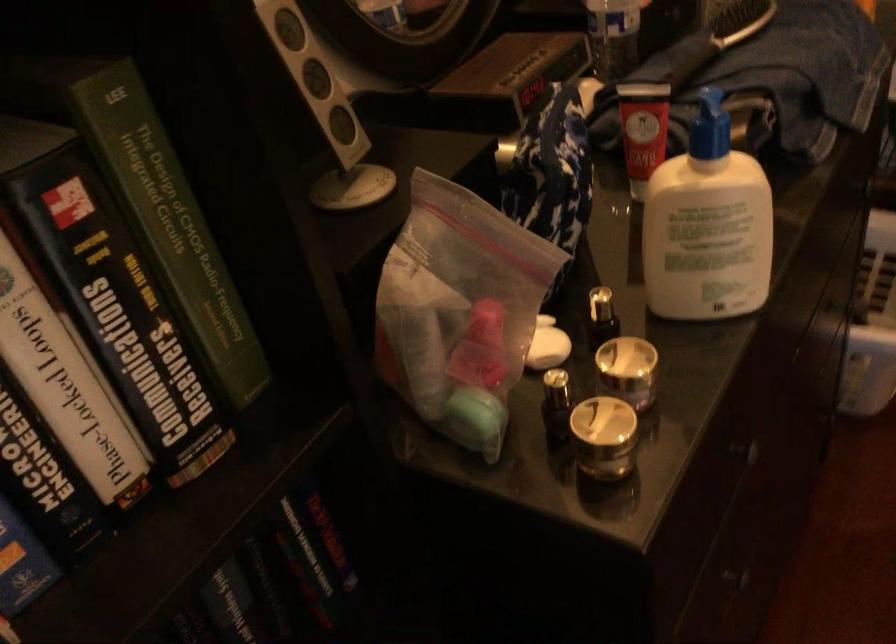
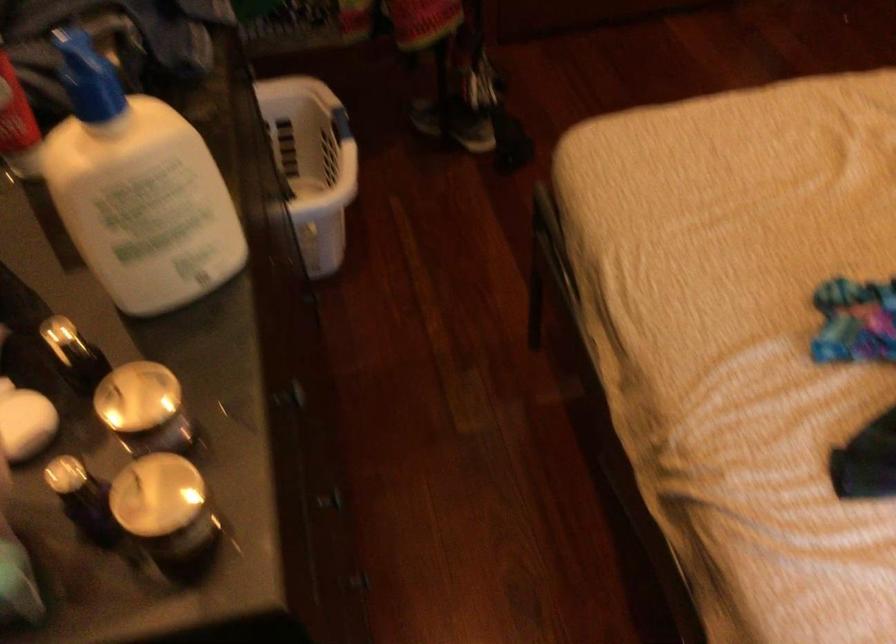
In the second image, find the point that corresponds to (591,415) in the first image.

(157, 495)